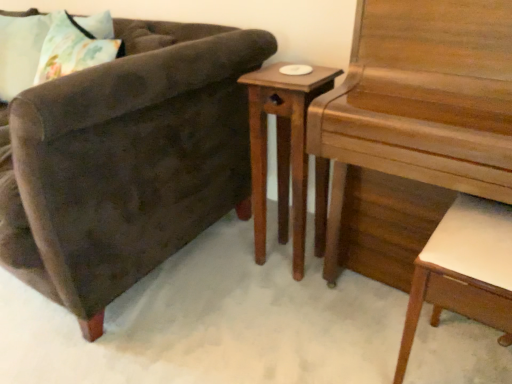
Identify the location of free space to the left of wooden nightstand at center. The height and width of the screenshot is (384, 512). click(228, 262).